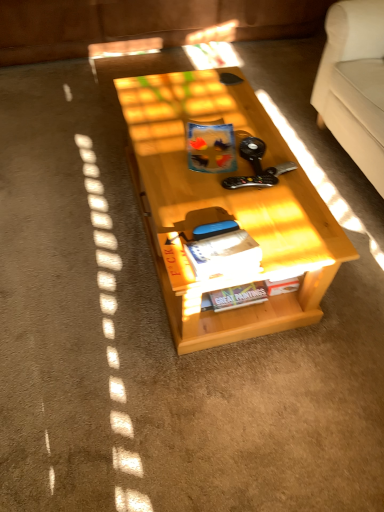
This screenshot has width=384, height=512. Find the location of `vacant space in front of matte plastic book at center, which ranks as the second book in front-to-back order`. vacant space in front of matte plastic book at center, which ranks as the second book in front-to-back order is located at coordinates (220, 200).